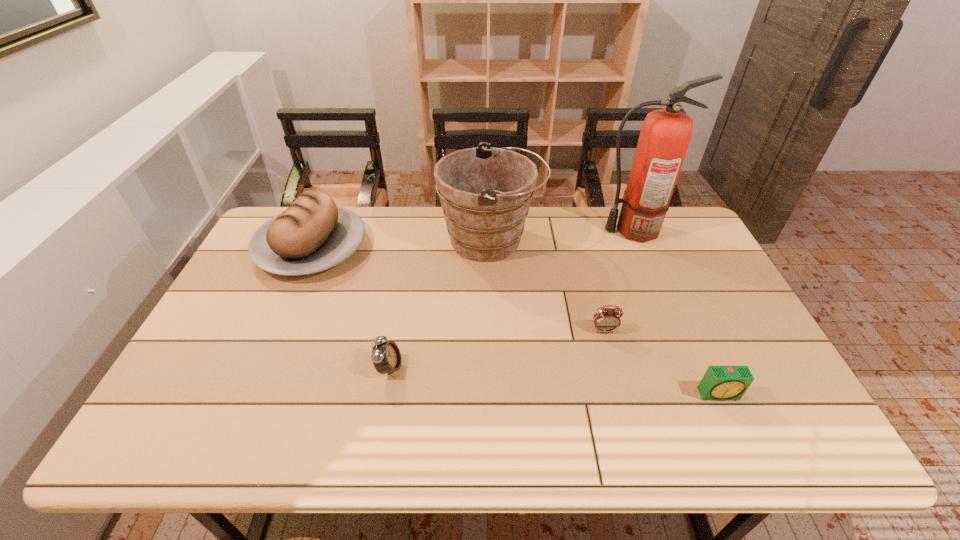
In the image, there is a desktop. At what (x,y) coordinates should I click in order to perform the action: click on vacant space at the near left corner. Please return your answer as a coordinate pair (x, y). Image resolution: width=960 pixels, height=540 pixels. Looking at the image, I should click on (218, 430).

In the image, there is a desktop. Identify the location of free region at the near right corner. The image size is (960, 540). (755, 431).

Locate an element on the screen. Image resolution: width=960 pixels, height=540 pixels. empty space that is in between the second object from left to right and the second alarm clock from right to left is located at coordinates (497, 349).

Where is `free space between the fire extinguisher and the second tallest object`? This screenshot has width=960, height=540. free space between the fire extinguisher and the second tallest object is located at coordinates (562, 235).

The image size is (960, 540). Identify the location of vacant area that lies between the rightmost alarm clock and the tallest object. (676, 312).

Where is `vacant space in between the fourth shortest object and the third nearest object`? The image size is (960, 540). vacant space in between the fourth shortest object and the third nearest object is located at coordinates (458, 289).

Locate an element on the screen. This screenshot has width=960, height=540. free spot between the fifth shortest object and the tallest object is located at coordinates (562, 235).

Identify the location of blank region between the second alarm clock from right to left and the fourth shortest object. click(458, 289).

Locate an element on the screen. The width and height of the screenshot is (960, 540). free space between the third object from right to left and the bucket is located at coordinates (547, 286).

I want to click on unoccupied area between the farthest alarm clock and the nearest object, so click(661, 362).